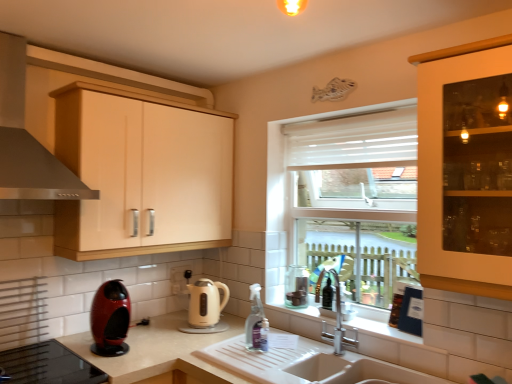
Measure the distance between point (220, 301) and camera.

7.79 feet.

I want to click on satin silver exhaust hood at upper left, so coord(27,139).

You are a GUI agent. You are given a task and a screenshot of the screen. Output one action in this format:
    pyautogui.click(x=<x>, y=<y>)
    Task: Click on the clear plastic spray bottle at sink
    This screenshot has height=384, width=512.
    Given the screenshot: What is the action you would take?
    pyautogui.click(x=256, y=323)

Locate an element on the screen. This screenshot has height=384, width=512. beige glossy electric kettle at center is located at coordinates [x=206, y=306].

Measure the distance from satin silver exhaust hood at upper left to white matte countertop at lower left.

satin silver exhaust hood at upper left is 35.72 inches away from white matte countertop at lower left.

Is point (19, 52) in front of point (233, 331)?

Yes, point (19, 52) is closer to viewer.

How many degrees apart are the facing directions of satin silver exhaust hood at upper left and white matte countertop at lower left?

They differ by 90 degrees in their facing directions.

Can you confirm if satin silver exhaust hood at upper left is positioned to the right of white matte countertop at lower left?

No.

Looking at this image, is matte wood cabinet at upper left to the left of metallic red coffee machine at lower left from the viewer's perspective?

Incorrect, matte wood cabinet at upper left is not on the left side of metallic red coffee machine at lower left.

Find the location of a particular element. The width and height of the screenshot is (512, 384). home appliance that appears in front of the matte wood cabinet at upper left is located at coordinates (110, 319).

Is matte wood cabinet at upper left placed right next to metallic red coffee machine at lower left?

No, matte wood cabinet at upper left is not touching metallic red coffee machine at lower left.

Can you tell me how much matte wood cabinet at upper left and metallic red coffee machine at lower left differ in facing direction?

0.00724 degrees.

Is matte wood cabinet at upper left oriented away from clear plastic spray bottle at sink?

matte wood cabinet at upper left does not have its back to clear plastic spray bottle at sink.

How many degrees apart are the facing directions of matte wood cabinet at upper left and clear plastic spray bottle at sink?

They differ by 91.1 degrees in their facing directions.

Would you say matte wood cabinet at upper left is inside or outside clear plastic spray bottle at sink?

The correct answer is: outside.

What's the angular difference between satin silver exhaust hood at upper left and metallic red coffee machine at lower left's facing directions?

The facing directions of satin silver exhaust hood at upper left and metallic red coffee machine at lower left are 0.0038 degrees apart.

Image resolution: width=512 pixels, height=384 pixels. What are the coordinates of `exhaust hood above the metallic red coffee machine at lower left (from a real-world perspective)` in the screenshot? It's located at (27, 139).

Based on the photo, is satin silver exhaust hood at upper left not within metallic red coffee machine at lower left?

Yes, satin silver exhaust hood at upper left is outside of metallic red coffee machine at lower left.

Could you tell me if matte wood cabinet at upper left is turned towards white matte countertop at lower left?

No, matte wood cabinet at upper left does not turn towards white matte countertop at lower left.

How different are the orientations of matte wood cabinet at upper left and white matte countertop at lower left in degrees?

90 degrees separate the facing orientations of matte wood cabinet at upper left and white matte countertop at lower left.

Is white matte countertop at lower left inside matte wood cabinet at upper left?

Actually, white matte countertop at lower left is outside matte wood cabinet at upper left.

Locate an element on the screen. Image resolution: width=512 pixels, height=384 pixels. cabinetry directly beneath the satin silver exhaust hood at upper left (from a real-world perspective) is located at coordinates (142, 174).

Is satin silver exhaust hood at upper left positioned in front of matte wood cabinet at upper left?

Yes, satin silver exhaust hood at upper left is closer to the viewer.

Which is nearer, (23,196) or (173,133)?

Point (23,196) appears to be closer to the viewer than point (173,133).

Can you tell me how much satin silver exhaust hood at upper left and matte wood cabinet at upper left differ in facing direction?

0.00344 degrees.

Which object is closer to the camera, metallic red coffee machine at lower left or clear plastic spray bottle at sink?

metallic red coffee machine at lower left is in front.

This screenshot has height=384, width=512. In order to click on home appliance that appears on the left of clear plastic spray bottle at sink in this screenshot , I will do `click(110, 319)`.

Which of these two, metallic red coffee machine at lower left or clear plastic spray bottle at sink, is bigger?

metallic red coffee machine at lower left is bigger.

Where is `exhaust hood that is on the left side of white matte countertop at lower left`? The width and height of the screenshot is (512, 384). exhaust hood that is on the left side of white matte countertop at lower left is located at coordinates (27, 139).

Locate an element on the screen. The image size is (512, 384). cabinetry above the metallic red coffee machine at lower left (from the image's perspective) is located at coordinates (142, 174).

Considering their positions, is metallic red coffee machine at lower left positioned further to white matte countertop at lower left than beige glossy electric kettle at center?

beige glossy electric kettle at center is positioned further to the anchor white matte countertop at lower left.

Consider the image. Estimate the real-world distances between objects in this image. Which object is closer to clear plastic spray bottle at sink, metallic red coffee machine at lower left or matte wood cabinet at upper left?

Among the two, metallic red coffee machine at lower left is located nearer to clear plastic spray bottle at sink.

When comparing their distances from clear plastic spray bottle at sink, does satin silver exhaust hood at upper left or matte wood cabinet at upper left seem closer?

The object closer to clear plastic spray bottle at sink is matte wood cabinet at upper left.

Estimate the real-world distances between objects in this image. Which object is further from metallic red coffee machine at lower left, matte wood cabinet at upper left or beige glossy electric kettle at center?

matte wood cabinet at upper left is positioned further to the anchor metallic red coffee machine at lower left.

Estimate the real-world distances between objects in this image. Which object is further from clear plastic spray bottle at sink, satin silver exhaust hood at upper left or white matte countertop at lower left?

Among the two, satin silver exhaust hood at upper left is located further to clear plastic spray bottle at sink.

Considering their positions, is clear plastic spray bottle at sink positioned further to metallic red coffee machine at lower left than beige glossy electric kettle at center?

clear plastic spray bottle at sink is positioned further to the anchor metallic red coffee machine at lower left.

Estimate the real-world distances between objects in this image. Which object is further from beige glossy electric kettle at center, clear plastic spray bottle at sink or matte wood cabinet at upper left?

matte wood cabinet at upper left is positioned further to the anchor beige glossy electric kettle at center.

Looking at the image, which one is located further to satin silver exhaust hood at upper left, white matte countertop at lower left or matte wood cabinet at upper left?

The object further to satin silver exhaust hood at upper left is white matte countertop at lower left.

This screenshot has width=512, height=384. Find the location of `home appliance between white matte countertop at lower left and clear plastic spray bottle at sink along the z-axis`. home appliance between white matte countertop at lower left and clear plastic spray bottle at sink along the z-axis is located at coordinates (110, 319).

Locate an element on the screen. Image resolution: width=512 pixels, height=384 pixels. bottle between matte wood cabinet at upper left and beige glossy electric kettle at center from top to bottom is located at coordinates (256, 323).

The height and width of the screenshot is (384, 512). Identify the location of kitchen appliance between metallic red coffee machine at lower left and clear plastic spray bottle at sink from left to right. (206, 306).

Find the location of a particular element. The height and width of the screenshot is (384, 512). bottle between satin silver exhaust hood at upper left and metallic red coffee machine at lower left from top to bottom is located at coordinates point(256,323).